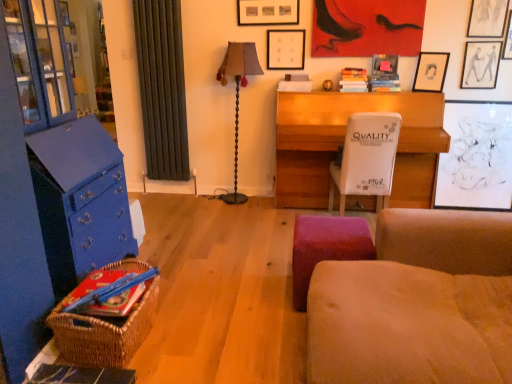
Identify the location of suede-like beige studio couch at lower right. (417, 304).

What do you see at coordinates (325, 248) in the screenshot? Image resolution: width=512 pixels, height=384 pixels. I see `velvet purple stool at lower center` at bounding box center [325, 248].

What do you see at coordinates (104, 332) in the screenshot? I see `woven brown picnic basket at lower left` at bounding box center [104, 332].

The width and height of the screenshot is (512, 384). Describe the element at coordinates (238, 95) in the screenshot. I see `brown fabric lamp at center` at that location.

Describe the element at coordinates (384, 82) in the screenshot. I see `hardcover book at upper right, positioned as the second book in front-to-back order` at that location.

At what (x,y) coordinates should I click in order to perform the action: click on matte black picture frame at upper right, which is the 1th picture frame from right to left. Please return your answer as a coordinate pair (x, y). The height and width of the screenshot is (384, 512). Looking at the image, I should click on (480, 64).

Locate an element on the screen. The width and height of the screenshot is (512, 384). suede-like beige studio couch at lower right is located at coordinates (417, 304).

Does suede-like beige studio couch at lower right lie behind velvet purple stool at lower center?

No, it is in front of velvet purple stool at lower center.

Is suede-like beige studio couch at lower right looking in the opposite direction of velvet purple stool at lower center?

suede-like beige studio couch at lower right is not turned away from velvet purple stool at lower center.

In order to click on studio couch above the velvet purple stool at lower center (from a real-world perspective) in this screenshot , I will do `click(417, 304)`.

What's the angular difference between suede-like beige studio couch at lower right and velvet purple stool at lower center's facing directions?

suede-like beige studio couch at lower right and velvet purple stool at lower center are facing 87.5 degrees away from each other.

Which of these two, hardcover book at upper right, positioned as the 1th book in top-to-bottom order, or velvet purple stool at lower center, is wider?

Wider between the two is velvet purple stool at lower center.

Considering the positions of point (350, 76) and point (354, 235), is point (350, 76) closer or farther from the camera than point (354, 235)?

Point (350, 76) appears to be farther away from the viewer than point (354, 235).

Is hardcover book at upper right, arranged as the 2th book when viewed from the right, with velvet purple stool at lower center?

No.

From the image's perspective, between hardcover book at upper right, which ranks as the 1th book in back-to-front order, and velvet purple stool at lower center, which one is located above?

hardcover book at upper right, which ranks as the 1th book in back-to-front order.

Can you tell me how much suede-like beige studio couch at lower right and matte black picture frame at upper right, acting as the fourth picture frame starting from the left, differ in facing direction?

The angular difference between suede-like beige studio couch at lower right and matte black picture frame at upper right, acting as the fourth picture frame starting from the left, is 62.5 degrees.

From a real-world perspective, is suede-like beige studio couch at lower right positioned under matte black picture frame at upper right, acting as the fourth picture frame starting from the left, based on gravity?

Yes, from a real-world perspective, suede-like beige studio couch at lower right is below matte black picture frame at upper right, acting as the fourth picture frame starting from the left.

Considering the sizes of objects suede-like beige studio couch at lower right and matte black picture frame at upper right, acting as the fourth picture frame starting from the left, in the image provided, who is bigger, suede-like beige studio couch at lower right or matte black picture frame at upper right, acting as the fourth picture frame starting from the left,?

suede-like beige studio couch at lower right is bigger.

Can you tell me how much white cardboard chair at center and matte black picture frame at upper right, acting as the 3th picture frame starting from the right, differ in facing direction?

154 degrees.

Does white cardboard chair at center have a larger size compared to matte black picture frame at upper right, acting as the 3th picture frame starting from the right?

Yes, white cardboard chair at center is bigger than matte black picture frame at upper right, acting as the 3th picture frame starting from the right.

Is there a large distance between white cardboard chair at center and matte black picture frame at upper right, acting as the fourth picture frame starting from the left?

No, white cardboard chair at center is in close proximity to matte black picture frame at upper right, acting as the fourth picture frame starting from the left.

From a real-world perspective, does white cardboard chair at center stand above matte black picture frame at upper right, acting as the 3th picture frame starting from the right?

Incorrect, from a real-world perspective, white cardboard chair at center is lower than matte black picture frame at upper right, acting as the 3th picture frame starting from the right.

How much distance is there between blue painted wood cabinet at left and matte white picture frame at upper center, which is the 5th picture frame from right to left?

2.12 meters.

Considering the sizes of objects blue painted wood cabinet at left and matte white picture frame at upper center, marked as the second picture frame in a left-to-right arrangement, in the image provided, who is shorter, blue painted wood cabinet at left or matte white picture frame at upper center, marked as the second picture frame in a left-to-right arrangement,?

matte white picture frame at upper center, marked as the second picture frame in a left-to-right arrangement, is shorter.

Considering the positions of objects blue painted wood cabinet at left and matte white picture frame at upper center, which is the 5th picture frame from right to left, in the image provided, who is in front, blue painted wood cabinet at left or matte white picture frame at upper center, which is the 5th picture frame from right to left,?

blue painted wood cabinet at left is closer to the camera.

From a real-world perspective, which is physically above, blue painted wood cabinet at left or matte white picture frame at upper center, marked as the second picture frame in a left-to-right arrangement?

matte white picture frame at upper center, marked as the second picture frame in a left-to-right arrangement, from a real-world perspective.

Is matte black picture frame at upper center, the first picture frame when ordered from left to right, positioned far away from blue painted wood cabinet at left?

That's right, there is a large distance between matte black picture frame at upper center, the first picture frame when ordered from left to right, and blue painted wood cabinet at left.

Consider the image. Which object is thinner, matte black picture frame at upper center, the first picture frame when ordered from left to right, or blue painted wood cabinet at left?

With smaller width is matte black picture frame at upper center, the first picture frame when ordered from left to right.

Where is `entertainment center below the matte black picture frame at upper center, arranged as the 6th picture frame when viewed from the right (from the image's perspective)`? This screenshot has width=512, height=384. entertainment center below the matte black picture frame at upper center, arranged as the 6th picture frame when viewed from the right (from the image's perspective) is located at coordinates (47, 179).

Between matte black picture frame at upper center, the first picture frame when ordered from left to right, and blue painted wood cabinet at left, which one appears on the right side from the viewer's perspective?

matte black picture frame at upper center, the first picture frame when ordered from left to right.

Does point (394, 60) come in front of point (118, 310)?

No, it is behind (118, 310).

From the picture: Between matte black picture frame at upper center, the third picture frame in the left-to-right sequence, and hardcover book at lower left, arranged as the first book when viewed from the front, which one appears on the left side from the viewer's perspective?

From the viewer's perspective, hardcover book at lower left, arranged as the first book when viewed from the front, appears more on the left side.

From the image's perspective, is matte black picture frame at upper center, which is the 4th picture frame from right to left, above hardcover book at lower left, the 3th book when ordered from top to bottom?

Correct, matte black picture frame at upper center, which is the 4th picture frame from right to left, appears higher than hardcover book at lower left, the 3th book when ordered from top to bottom, in the image.

Consider the image. From a real-world perspective, does matte black picture frame at upper center, the third picture frame in the left-to-right sequence, stand above hardcover book at lower left, arranged as the first book when viewed from the front?

Correct, in the physical world, matte black picture frame at upper center, the third picture frame in the left-to-right sequence, is higher than hardcover book at lower left, arranged as the first book when viewed from the front.

The image size is (512, 384). I want to click on studio couch lying in front of the velvet purple stool at lower center, so click(x=417, y=304).

Where is `stool below the hardcover book at upper right, which ranks as the 1th book in back-to-front order (from a real-world perspective)`? The height and width of the screenshot is (384, 512). stool below the hardcover book at upper right, which ranks as the 1th book in back-to-front order (from a real-world perspective) is located at coordinates (325, 248).

Considering their positions, is hardcover book at upper right, which is the third book from front to back, positioned further to blue painted wood cabinet at left than hardcover book at upper right, the 2th book when ordered from top to bottom?

Among the two, hardcover book at upper right, the 2th book when ordered from top to bottom, is located further to blue painted wood cabinet at left.

From the image, which object appears to be nearer to matte black picture frame at upper center, the third picture frame in the left-to-right sequence, brown fabric lamp at center or matte black picture frame at upper right, which ranks as the 2th picture frame in right-to-left order?

The object closer to matte black picture frame at upper center, the third picture frame in the left-to-right sequence, is matte black picture frame at upper right, which ranks as the 2th picture frame in right-to-left order.

Based on the photo, based on their spatial positions, is matte black picture frame at upper right, acting as the 3th picture frame starting from the right, or velvet purple stool at lower center further from matte black picture frame at upper right, which is the 1th picture frame from right to left?

Based on the image, velvet purple stool at lower center appears to be further to matte black picture frame at upper right, which is the 1th picture frame from right to left.

When comparing their distances from white cardboard chair at center, does woven brown picnic basket at lower left or matte black picture frame at upper center, the third picture frame in the left-to-right sequence, seem closer?

matte black picture frame at upper center, the third picture frame in the left-to-right sequence, is closer to white cardboard chair at center.

When comparing their distances from hardcover book at upper right, the 2th book when ordered from top to bottom, does blue painted wood cabinet at left or velvet purple stool at lower center seem closer?

Based on the image, velvet purple stool at lower center appears to be nearer to hardcover book at upper right, the 2th book when ordered from top to bottom.

When comparing their distances from matte black picture frame at upper right, acting as the 3th picture frame starting from the right, does woven brown picnic basket at lower left or white cardboard chair at center seem further?

woven brown picnic basket at lower left is further to matte black picture frame at upper right, acting as the 3th picture frame starting from the right.

Which object lies further to the anchor point matte black picture frame at upper right, the 6th picture frame when ordered from left to right, hardcover book at upper right, the 2th book when ordered from bottom to top, or velvet purple stool at lower center?

The object further to matte black picture frame at upper right, the 6th picture frame when ordered from left to right, is velvet purple stool at lower center.

Based on their spatial positions, is matte black picture frame at upper center, the third picture frame in the left-to-right sequence, or matte white picture frame at upper center, marked as the second picture frame in a left-to-right arrangement, closer to wooden desk at center?

matte black picture frame at upper center, the third picture frame in the left-to-right sequence, is positioned closer to the anchor wooden desk at center.

Find the location of a particular element. This screenshot has width=512, height=384. desk between suede-like beige studio couch at lower right and matte black picture frame at upper right, which ranks as the 2th picture frame in right-to-left order, from front to back is located at coordinates (343, 142).

Find the location of a particular element. The height and width of the screenshot is (384, 512). desk located between hardcover book at lower left, the 3th book when ordered from top to bottom, and matte black picture frame at upper right, acting as the 3th picture frame starting from the right, in the left-right direction is located at coordinates (343, 142).

Image resolution: width=512 pixels, height=384 pixels. What are the coordinates of `picnic basket between suede-like beige studio couch at lower right and wooden desk at center from front to back` in the screenshot? It's located at (104, 332).

You are a GUI agent. You are given a task and a screenshot of the screen. Output one action in this format:
    pyautogui.click(x=<x>, y=<y>)
    Task: Click on the stool between blue painted wood cabinet at left and white cardboard chair at center in the horizontal direction
    
    Given the screenshot: What is the action you would take?
    pyautogui.click(x=325, y=248)